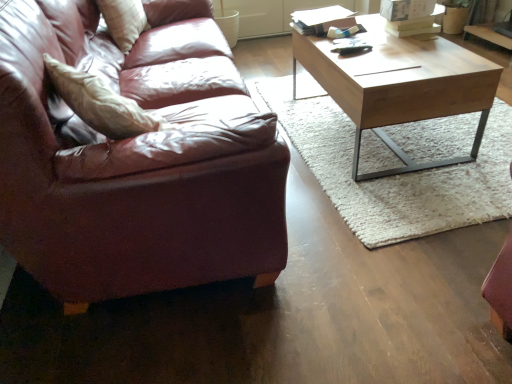
Question: Is the position of leather couch at left less distant than that of plush white pillow at upper left?

Choices:
 (A) yes
 (B) no

Answer: (A)

Question: Could you tell me if leather couch at left is turned towards plush white pillow at upper left?

Choices:
 (A) no
 (B) yes

Answer: (A)

Question: Would you say leather couch at left is outside plush white pillow at upper left?

Choices:
 (A) yes
 (B) no

Answer: (A)

Question: Is the surface of leather couch at left in direct contact with plush white pillow at upper left?

Choices:
 (A) no
 (B) yes

Answer: (A)

Question: Can you confirm if leather couch at left is positioned to the right of plush white pillow at upper left?

Choices:
 (A) no
 (B) yes

Answer: (B)

Question: Is plush white pillow at upper left in front of or behind light brown wood coffee table at center in the image?

Choices:
 (A) front
 (B) behind

Answer: (B)

Question: In the image, is plush white pillow at upper left on the left side or the right side of light brown wood coffee table at center?

Choices:
 (A) left
 (B) right

Answer: (A)

Question: From a real-world perspective, is plush white pillow at upper left physically located above or below light brown wood coffee table at center?

Choices:
 (A) above
 (B) below

Answer: (A)

Question: In terms of width, does plush white pillow at upper left look wider or thinner when compared to light brown wood coffee table at center?

Choices:
 (A) wide
 (B) thin

Answer: (B)

Question: Do you think leather couch at left is within plush white pillow at upper left, or outside of it?

Choices:
 (A) outside
 (B) inside

Answer: (A)

Question: Is leather couch at left in front of or behind plush white pillow at upper left in the image?

Choices:
 (A) front
 (B) behind

Answer: (A)

Question: From a real-world perspective, is leather couch at left above or below plush white pillow at upper left?

Choices:
 (A) above
 (B) below

Answer: (B)

Question: Based on their sizes in the image, would you say leather couch at left is bigger or smaller than plush white pillow at upper left?

Choices:
 (A) small
 (B) big

Answer: (B)

Question: In terms of size, does plush white pillow at upper left appear bigger or smaller than leather couch at left?

Choices:
 (A) small
 (B) big

Answer: (A)

Question: Is point (143, 13) closer or farther from the camera than point (48, 165)?

Choices:
 (A) farther
 (B) closer

Answer: (A)